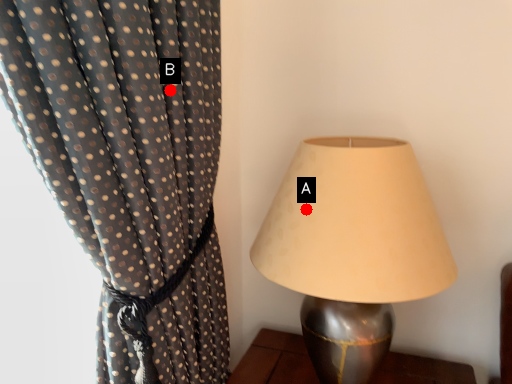
Question: Two points are circled on the image, labeled by A and B beside each circle. Which point is closer to the camera?

Choices:
 (A) A is closer
 (B) B is closer

Answer: (B)